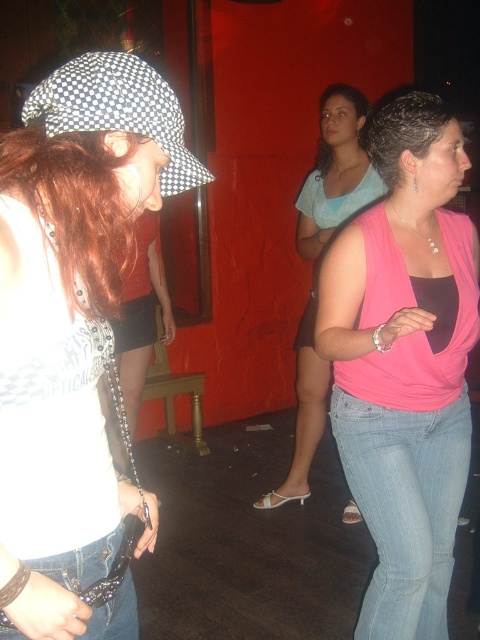
You are an AI analyzing the image. The coordinate system has its origin at the bottom left corner of the image. The dark curly hair at upper right is located at what coordinates?

The dark curly hair at upper right is located at coordinates point (404, 131).

Based on the scene description, which object is visually more prominent between the shiny red hair at left and the denim jeans at lower left?

The shiny red hair at left is larger in size than the denim jeans at lower left, making it more visually prominent.

You are a photographer setting up a tripod in this scene. You need to place it between the shiny red hair at left and the denim jeans at lower left so that it doesn

The distance between the shiny red hair at left and the denim jeans at lower left is 18.90 inches, so the tripod should be placed exactly halfway between them at 9.45 inches from each object.